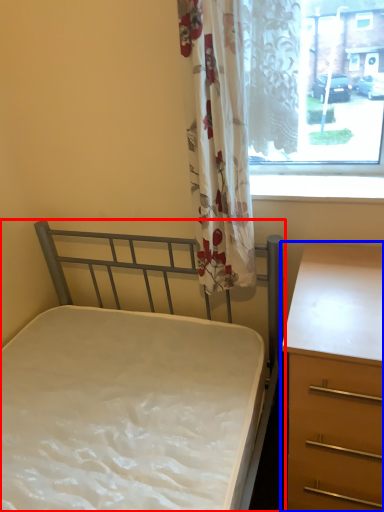
Question: Which object appears closest to the camera in this image, bed (highlighted by a red box) or chest of drawers (highlighted by a blue box)?

Choices:
 (A) bed
 (B) chest of drawers

Answer: (A)